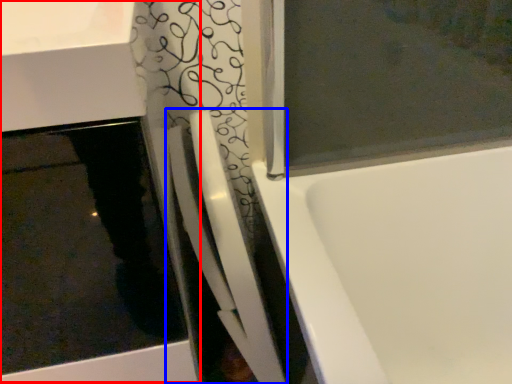
Question: Which of the following is the closest to the observer, sink (highlighted by a red box) or shower door (highlighted by a blue box)?

Choices:
 (A) sink
 (B) shower door

Answer: (A)